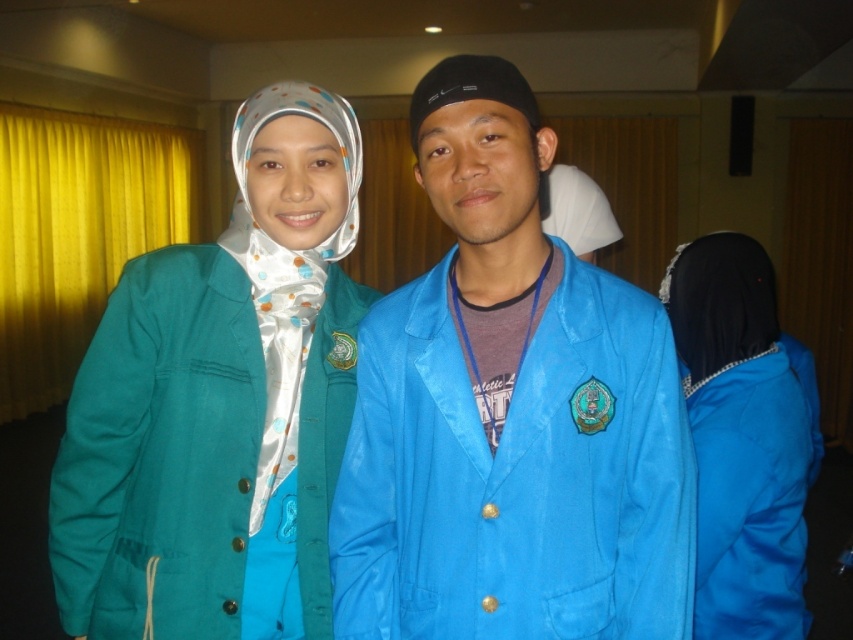
You are an event planner organizing a photo shoot and need to position a teal fabric hijab at left in the image. Where should you place it to match the original scene?

Place the teal fabric hijab at left at coordinates approximately 0.631 on the x axis and 0.259 on the y axis.